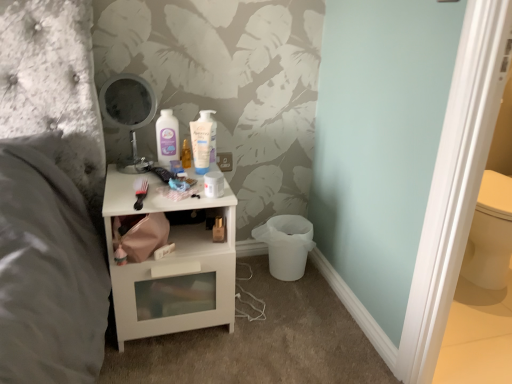
Question: In terms of height, does metallic round mirror at upper center look taller or shorter compared to matte plastic mouthwash at center, the 1th mouthwash from the left?

Choices:
 (A) short
 (B) tall

Answer: (B)

Question: Considering the positions of point (138, 77) and point (169, 119), is point (138, 77) closer or farther from the camera than point (169, 119)?

Choices:
 (A) farther
 (B) closer

Answer: (B)

Question: Which object is positioned farthest from the white glossy mouthwash at center, which ranks as the 2th mouthwash in left-to-right order?

Choices:
 (A) metallic round mirror at upper center
 (B) white glossy nightstand at center
 (C) matte plastic mouthwash at center, the 1th mouthwash from the left

Answer: (B)

Question: Considering the real-world distances, which object is farthest from the white glossy mouthwash at center, which is the first mouthwash from right to left?

Choices:
 (A) white glossy nightstand at center
 (B) matte plastic mouthwash at center, the 1th mouthwash from the left
 (C) metallic round mirror at upper center

Answer: (A)